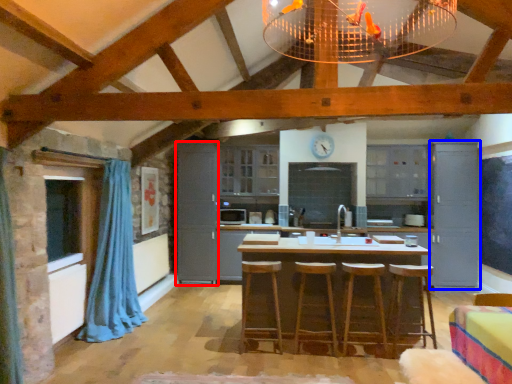
Question: Which object is closer to the camera taking this photo, cabinetry (highlighted by a red box) or cabinetry (highlighted by a blue box)?

Choices:
 (A) cabinetry
 (B) cabinetry

Answer: (B)